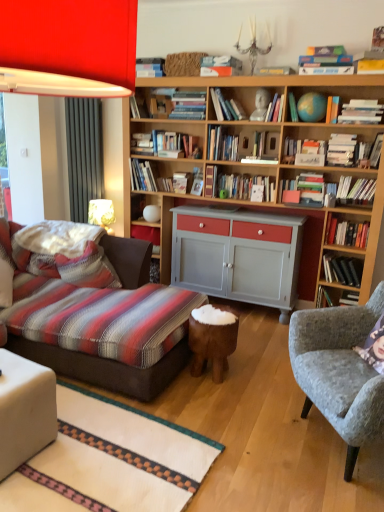
Identify the location of hardcover book at center, the 16th book when ordered from right to left. (221, 145).

This screenshot has height=512, width=384. Find the location of `black hardcover book at right, the fourth book when ordered from right to left`. black hardcover book at right, the fourth book when ordered from right to left is located at coordinates (342, 270).

This screenshot has width=384, height=512. What do you see at coordinates (342, 270) in the screenshot? I see `black hardcover book at right, the seventeenth book when ordered from left to right` at bounding box center [342, 270].

The width and height of the screenshot is (384, 512). Describe the element at coordinates (147, 234) in the screenshot. I see `matte red shelf at center` at that location.

Image resolution: width=384 pixels, height=512 pixels. What are the coordinates of `hardcover book at center, the 17th book positioned from the right` in the screenshot? It's located at (188, 105).

Image resolution: width=384 pixels, height=512 pixels. What do you see at coordinates (326, 61) in the screenshot? I see `hardcover books at upper right, the twelfth book from the left` at bounding box center [326, 61].

Image resolution: width=384 pixels, height=512 pixels. What do you see at coordinates (142, 144) in the screenshot? I see `hardcover book at center, which is the 19th book in right-to-left order` at bounding box center [142, 144].

Find the location of `hardcover book at center, which ranks as the fifth book in left-to-right order`. hardcover book at center, which ranks as the fifth book in left-to-right order is located at coordinates (221, 145).

Is white fabric table lamp at lower left bigger than hardcover book at center, the 17th book positioned from the right?

Yes.

Is white fabric table lamp at lower left turned away from hardcover book at center, the 17th book positioned from the right?

No, white fabric table lamp at lower left is not facing away from hardcover book at center, the 17th book positioned from the right.

From the image's perspective, which is above, white fabric table lamp at lower left or hardcover book at center, the fourth book when ordered from left to right?

hardcover book at center, the fourth book when ordered from left to right, is shown above in the image.

Which object is closer to the camera, hardcover book at upper right, the tenth book when ordered from left to right, or hardcover book at upper right, which appears as the fifth book when viewed from the right?

hardcover book at upper right, which appears as the fifth book when viewed from the right, is closer to the camera.

Considering the relative positions of hardcover book at upper right, acting as the eleventh book starting from the right, and hardcover book at upper right, which appears as the fifth book when viewed from the right, in the image provided, is hardcover book at upper right, acting as the eleventh book starting from the right, to the left or to the right of hardcover book at upper right, which appears as the fifth book when viewed from the right,?

Based on their positions, hardcover book at upper right, acting as the eleventh book starting from the right, is located to the left of hardcover book at upper right, which appears as the fifth book when viewed from the right.

From a real-world perspective, count 4th books downward from the hardcover book at upper right, acting as the 16th book starting from the left, and point to it. Please provide its 2D coordinates.

[(305, 152)]

Considering the sizes of objects hardcover book at upper right, the tenth book when ordered from left to right, and hardcover book at upper right, which appears as the fifth book when viewed from the right, in the image provided, who is thinner, hardcover book at upper right, the tenth book when ordered from left to right, or hardcover book at upper right, which appears as the fifth book when viewed from the right,?

hardcover book at upper right, the tenth book when ordered from left to right, is thinner.

How different are the orientations of hardcover book at upper center, marked as the twentieth book in a right-to-left arrangement, and hardcover book at upper right, acting as the second book starting from the right, in degrees?

2.53 degrees separate the facing orientations of hardcover book at upper center, marked as the twentieth book in a right-to-left arrangement, and hardcover book at upper right, acting as the second book starting from the right.

Is hardcover book at upper center, marked as the twentieth book in a right-to-left arrangement, positioned with its back to hardcover book at upper right, acting as the second book starting from the right?

hardcover book at upper center, marked as the twentieth book in a right-to-left arrangement, does not have its back to hardcover book at upper right, acting as the second book starting from the right.

Is hardcover book at upper center, which appears as the first book when viewed from the left, smaller than hardcover book at upper right, which is the 19th book in left-to-right order?

Indeed, hardcover book at upper center, which appears as the first book when viewed from the left, has a smaller size compared to hardcover book at upper right, which is the 19th book in left-to-right order.

Locate an element on the screen. the 18th book to the left when counting from the hardcover book at upper right, acting as the second book starting from the right is located at coordinates (138, 108).

From the image's perspective, which one is positioned lower, hardcover book at center-right, which ranks as the fourteenth book in left-to-right order, or orange matte book at upper center, arranged as the 6th book when viewed from the left?

hardcover book at center-right, which ranks as the fourteenth book in left-to-right order, from the image's perspective.

Would you say hardcover book at center-right, which is the 7th book from right to left, is to the left or to the right of orange matte book at upper center, arranged as the 6th book when viewed from the left, in the picture?

Clearly, hardcover book at center-right, which is the 7th book from right to left, is on the right of orange matte book at upper center, arranged as the 6th book when viewed from the left, in the image.

Considering the sizes of hardcover book at center-right, which ranks as the fourteenth book in left-to-right order, and orange matte book at upper center, the 15th book positioned from the right, in the image, is hardcover book at center-right, which ranks as the fourteenth book in left-to-right order, taller or shorter than orange matte book at upper center, the 15th book positioned from the right,?

Considering their sizes, hardcover book at center-right, which ranks as the fourteenth book in left-to-right order, has more height than orange matte book at upper center, the 15th book positioned from the right.

Which object is thinner, hardcover book at center-right, which ranks as the fourteenth book in left-to-right order, or orange matte book at upper center, arranged as the 6th book when viewed from the left?

hardcover book at center-right, which ranks as the fourteenth book in left-to-right order.

Is hardcover book at center, which ranks as the fifth book in left-to-right order, situated inside white fabric ottoman at lower left or outside?

hardcover book at center, which ranks as the fifth book in left-to-right order, is outside white fabric ottoman at lower left.

Which is less distant, [213,152] or [5,397]?

Point [213,152].

Is hardcover book at center, the 16th book when ordered from right to left, taller than white fabric ottoman at lower left?

Incorrect, the height of hardcover book at center, the 16th book when ordered from right to left, is not larger of that of white fabric ottoman at lower left.

Between hardcover book at center, which ranks as the fifth book in left-to-right order, and white fabric ottoman at lower left, which one has smaller size?

hardcover book at center, which ranks as the fifth book in left-to-right order, is smaller.

Who is bigger, hardcover books at upper right, the twelfth book from the left, or matte red shelf at center?

Bigger between the two is hardcover books at upper right, the twelfth book from the left.

Could you measure the distance between hardcover books at upper right, the twelfth book from the left, and matte red shelf at center?

A distance of 6.88 feet exists between hardcover books at upper right, the twelfth book from the left, and matte red shelf at center.

In terms of height, does hardcover books at upper right, which is the 9th book from right to left, look taller or shorter compared to matte red shelf at center?

hardcover books at upper right, which is the 9th book from right to left, is shorter than matte red shelf at center.

From the image's perspective, is hardcover books at upper right, which is the 9th book from right to left, over matte red shelf at center?

Yes, from the image's perspective, hardcover books at upper right, which is the 9th book from right to left, is above matte red shelf at center.

Looking at this image, from the image's perspective, who appears lower, hardcover books at center, the eighteenth book in the right-to-left sequence, or hardcover book at center-right, placed as the 11th book when sorted from left to right?

hardcover book at center-right, placed as the 11th book when sorted from left to right, is shown below in the image.

Could you tell me if hardcover books at center, the eighteenth book in the right-to-left sequence, is turned towards hardcover book at center-right, placed as the 11th book when sorted from left to right?

No, hardcover books at center, the eighteenth book in the right-to-left sequence, is not oriented towards hardcover book at center-right, placed as the 11th book when sorted from left to right.

Which of these two, hardcover books at center, arranged as the 3th book when viewed from the left, or hardcover book at center-right, placed as the 11th book when sorted from left to right, stands shorter?

hardcover book at center-right, placed as the 11th book when sorted from left to right, is shorter.

Where is `the 13th book positioned above the white fabric table lamp at lower left (from a real-world perspective)`? the 13th book positioned above the white fabric table lamp at lower left (from a real-world perspective) is located at coordinates (188, 105).

Identify the location of the 6th book counting from the right of the hardcover book at upper right, the tenth book when ordered from left to right. The width and height of the screenshot is (384, 512). tap(361, 112).

In the scene shown: Based on their spatial positions, is hardcover book at center, which is the 19th book in right-to-left order, or hardcover book at right, the eighteenth book positioned from the left, closer to hardcover book at center-right, which ranks as the fourteenth book in left-to-right order?

hardcover book at right, the eighteenth book positioned from the left, lies closer to hardcover book at center-right, which ranks as the fourteenth book in left-to-right order, than the other object.

When comparing their distances from hardcover book at center-right, which ranks as the fourteenth book in left-to-right order, does hardcover book at upper center, the eighth book viewed from the left, or hardcover book at center-right, placed as the 11th book when sorted from left to right, seem further?

The object further to hardcover book at center-right, which ranks as the fourteenth book in left-to-right order, is hardcover book at upper center, the eighth book viewed from the left.

From the image, which object appears to be nearer to brown wooden stool at center, hardcover book at upper right, arranged as the 1th book when viewed from the right, or hardcover book at center, which ranks as the fifth book in left-to-right order?

Based on the image, hardcover book at center, which ranks as the fifth book in left-to-right order, appears to be nearer to brown wooden stool at center.

When comparing their distances from hardcover book at center-right, placed as the 11th book when sorted from left to right, does brown wooden stool at center or hardcover book at upper right, the tenth book when ordered from left to right, seem closer?

Among the two, hardcover book at upper right, the tenth book when ordered from left to right, is located nearer to hardcover book at center-right, placed as the 11th book when sorted from left to right.

From the picture: From the image, which object appears to be nearer to hardcover book at upper right, acting as the 16th book starting from the left, hardcover book at upper right, the tenth book when ordered from left to right, or white fabric ottoman at lower left?

hardcover book at upper right, the tenth book when ordered from left to right, lies closer to hardcover book at upper right, acting as the 16th book starting from the left, than the other object.

When comparing their distances from green matte globe at upper center, the 9th book in the left-to-right sequence, does hardcover book at upper center, which is the seventh book in left-to-right order, or hardcover book at upper right, which is the 19th book in left-to-right order, seem further?

hardcover book at upper right, which is the 19th book in left-to-right order, is positioned further to the anchor green matte globe at upper center, the 9th book in the left-to-right sequence.

When comparing their distances from hardcover book at center-right, which ranks as the fourteenth book in left-to-right order, does brown wooden stool at center or hardcover book at upper center, the 13th book from the right, seem closer?

Based on the image, brown wooden stool at center appears to be nearer to hardcover book at center-right, which ranks as the fourteenth book in left-to-right order.

Which object lies nearer to the anchor point hardcover book at upper right, acting as the 16th book starting from the left, hardcover book at center-right, which ranks as the fourteenth book in left-to-right order, or hardcover book at upper center, the 13th book from the right?

The object closer to hardcover book at upper right, acting as the 16th book starting from the left, is hardcover book at upper center, the 13th book from the right.

Locate an element on the screen. Image resolution: width=384 pixels, height=512 pixels. pillow between matte red lampshade at upper left and hardcover book at upper right, acting as the eleventh book starting from the right, along the z-axis is located at coordinates (88, 268).

Locate an element on the screen. The height and width of the screenshot is (512, 384). table lamp between white fabric ottoman at lower left and hardcover book at upper right, acting as the 16th book starting from the left, from left to right is located at coordinates (102, 214).

At what (x,y) coordinates should I click in order to perform the action: click on pillow between matte red lampshade at upper left and black hardcover book at right, the fourth book when ordered from right to left, along the z-axis. Please return your answer as a coordinate pair (x, y). The height and width of the screenshot is (512, 384). Looking at the image, I should click on (88, 268).

You are a GUI agent. You are given a task and a screenshot of the screen. Output one action in this format:
    pyautogui.click(x=<x>, y=<y>)
    Task: Click on the pillow between hardcover book at upper center, marked as the twentieth book in a right-to-left arrangement, and brown wooden stool at center, in the vertical direction
    
    Given the screenshot: What is the action you would take?
    pyautogui.click(x=88, y=268)